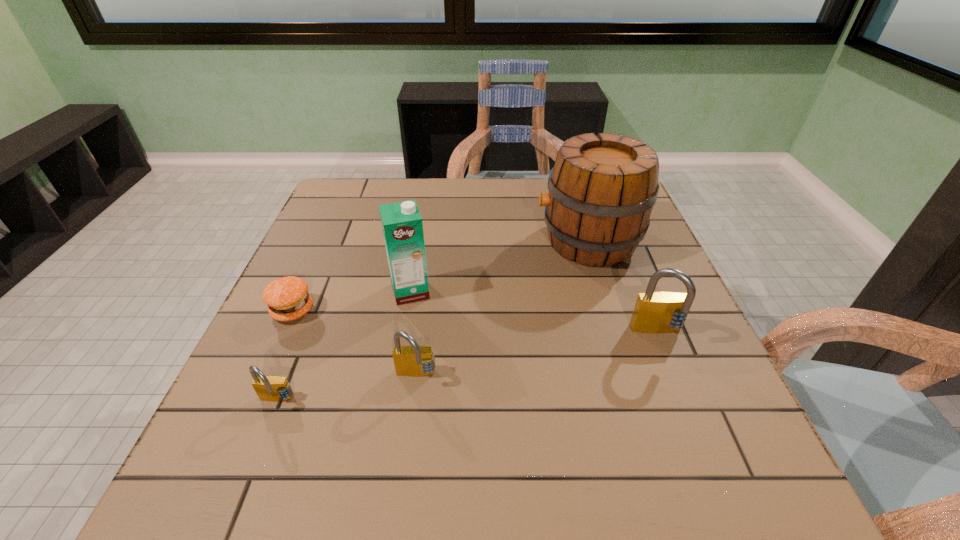
Please mark a free spot for a new padlock to balance the arrangement. Please provide its 2D coordinates. Your answer should be formatted as a tuple, i.e. [(x, y)], where the tuple contains the x and y coordinates of a point satisfying the conditions above.

[(542, 354)]